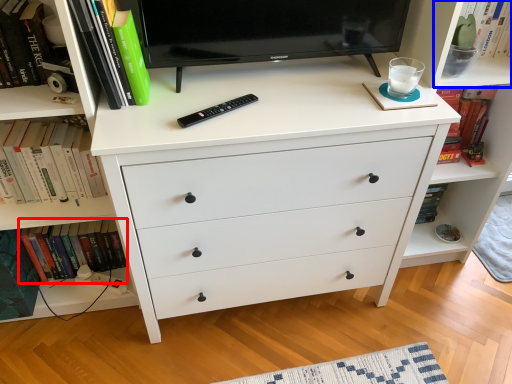
Question: Which object appears closest to the camera in this image, book (highlighted by a red box) or shelf (highlighted by a blue box)?

Choices:
 (A) book
 (B) shelf

Answer: (B)